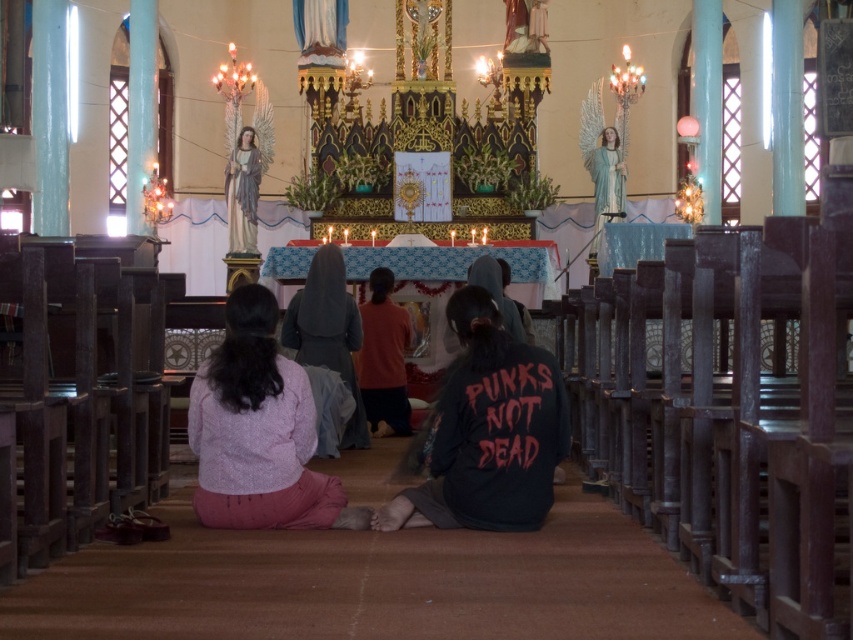
Question: Considering the real-world distances, which object is closest to the pink fabric skirt at lower center?

Choices:
 (A) black matte sweatshirt at center
 (B) dark gray fabric at center
 (C) matte gray statue at upper center

Answer: (A)

Question: Which object is farther from the camera taking this photo?

Choices:
 (A) matte gray statue at upper center
 (B) dark gray fabric at center

Answer: (A)

Question: Considering the relative positions of pink fabric skirt at lower center and dark gray fabric at center in the image provided, where is pink fabric skirt at lower center located with respect to dark gray fabric at center?

Choices:
 (A) above
 (B) below

Answer: (B)

Question: Considering the real-world distances, which object is closest to the dark gray fabric at center?

Choices:
 (A) pink fabric skirt at lower center
 (B) matte gray statue at upper center
 (C) black matte sweatshirt at center

Answer: (C)

Question: Is black matte sweatshirt at center in front of dark gray fabric at center?

Choices:
 (A) no
 (B) yes

Answer: (B)

Question: Is black matte sweatshirt at center above matte gray statue at upper center?

Choices:
 (A) no
 (B) yes

Answer: (A)